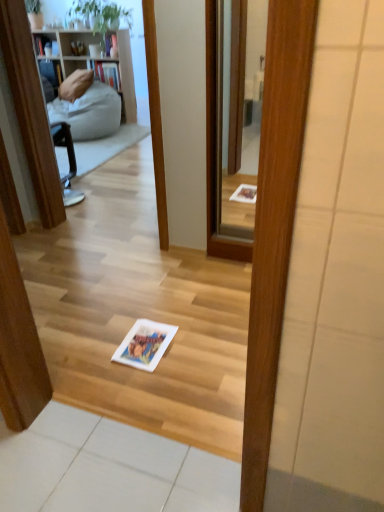
Question: From the image's perspective, is clear glass mirror at center on white paper book at center?

Choices:
 (A) yes
 (B) no

Answer: (A)

Question: Is clear glass mirror at center positioned before white paper book at center?

Choices:
 (A) no
 (B) yes

Answer: (A)

Question: Does clear glass mirror at center touch white paper book at center?

Choices:
 (A) no
 (B) yes

Answer: (A)

Question: Considering the relative positions of clear glass mirror at center and white paper book at center in the image provided, is clear glass mirror at center behind white paper book at center?

Choices:
 (A) yes
 (B) no

Answer: (A)

Question: Would you say clear glass mirror at center is outside white paper book at center?

Choices:
 (A) no
 (B) yes

Answer: (B)

Question: Considering the relative sizes of clear glass mirror at center and white paper book at center in the image provided, is clear glass mirror at center taller than white paper book at center?

Choices:
 (A) yes
 (B) no

Answer: (A)

Question: Considering the relative sizes of white paper book at center and clear glass mirror at center in the image provided, is white paper book at center shorter than clear glass mirror at center?

Choices:
 (A) no
 (B) yes

Answer: (B)

Question: Considering the relative sizes of white paper book at center and clear glass mirror at center in the image provided, is white paper book at center bigger than clear glass mirror at center?

Choices:
 (A) no
 (B) yes

Answer: (A)

Question: From the image's perspective, is white paper book at center above clear glass mirror at center?

Choices:
 (A) no
 (B) yes

Answer: (A)

Question: Considering the relative sizes of white paper book at center and clear glass mirror at center in the image provided, is white paper book at center wider than clear glass mirror at center?

Choices:
 (A) yes
 (B) no

Answer: (A)

Question: Considering the relative positions of white paper book at center and clear glass mirror at center in the image provided, is white paper book at center to the right of clear glass mirror at center from the viewer's perspective?

Choices:
 (A) yes
 (B) no

Answer: (B)

Question: From the image's perspective, is white paper book at center under clear glass mirror at center?

Choices:
 (A) no
 (B) yes

Answer: (B)

Question: Would you say white paper book at center is to the left or to the right of clear glass mirror at center in the picture?

Choices:
 (A) right
 (B) left

Answer: (B)